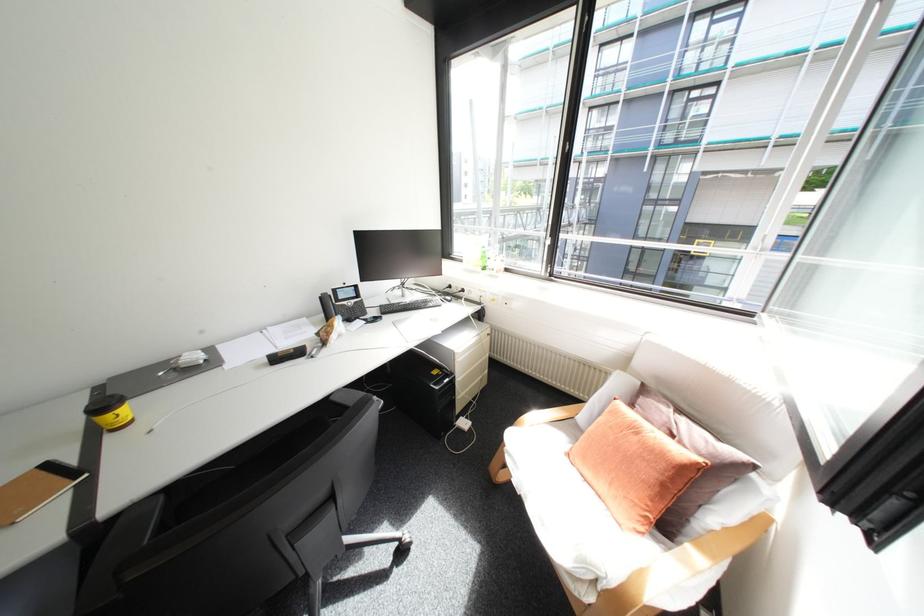
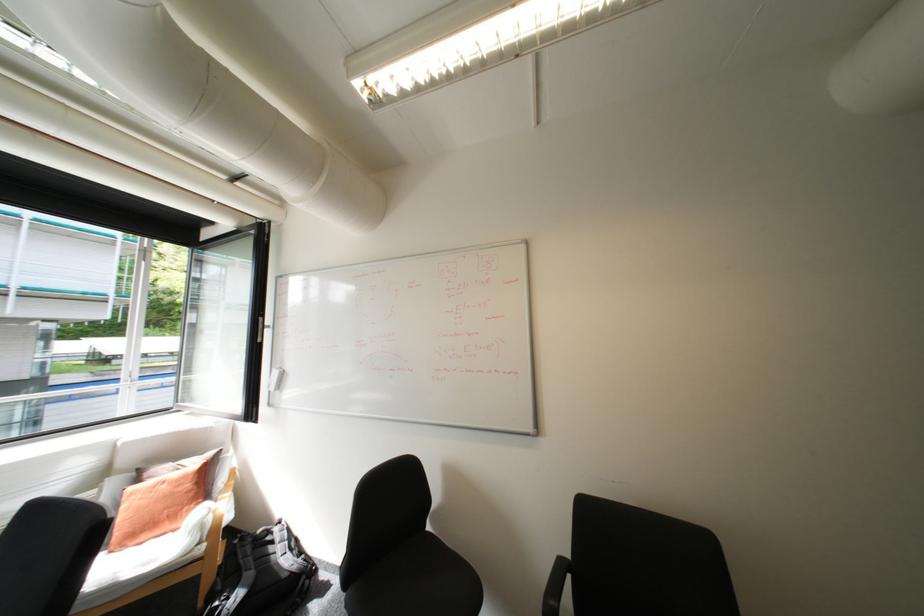
Where in the second image is the point corresponding to pixel 645 439 from the first image?

(175, 485)